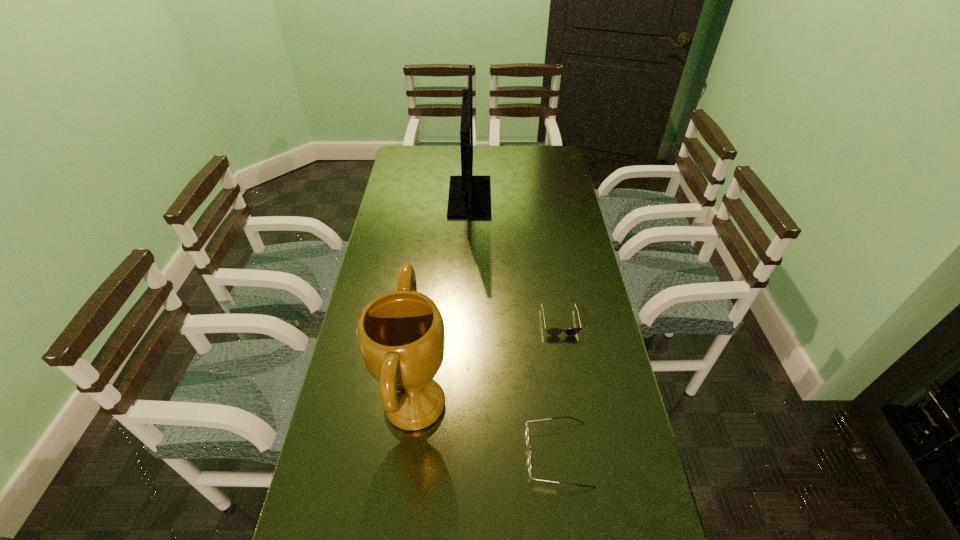
Find the location of `blank region between the farthest object and the second tallest object`. blank region between the farthest object and the second tallest object is located at coordinates (443, 301).

This screenshot has height=540, width=960. I want to click on object that is the second closest to the tallest object, so click(401, 335).

Identify the location of object that stands as the closest to the third tallest object. The height and width of the screenshot is (540, 960). (401, 335).

The width and height of the screenshot is (960, 540). Find the location of `free location that satisfies the following two spatial constraints: 1. on the front lenses of the sunglasses; 2. through the lenses of the spectacles`. free location that satisfies the following two spatial constraints: 1. on the front lenses of the sunglasses; 2. through the lenses of the spectacles is located at coordinates (582, 454).

Locate an element on the screen. This screenshot has width=960, height=540. free space that satisfies the following two spatial constraints: 1. on the front lenses of the shortest object; 2. on the front of the award with the decoration is located at coordinates (574, 404).